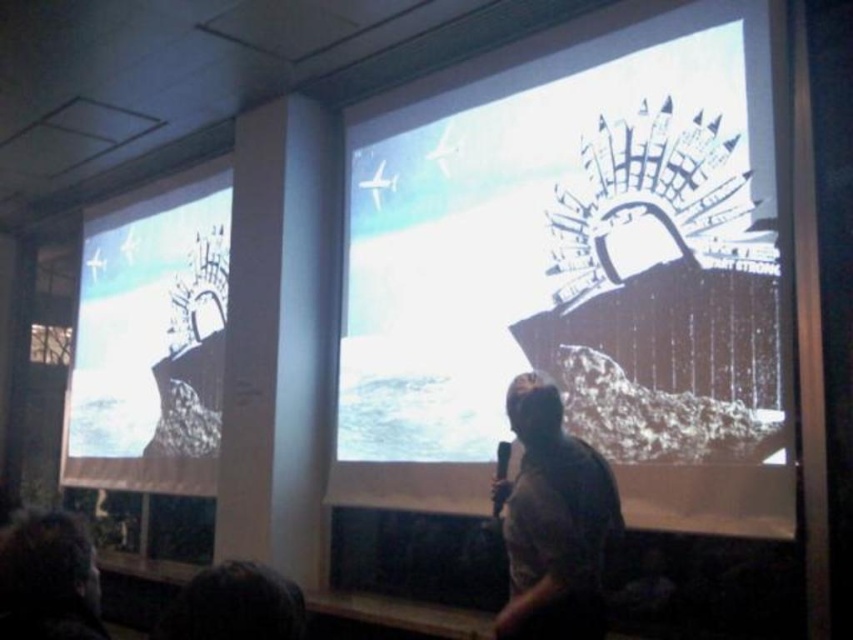
Question: Which object is positioned farthest from the gray fabric shirt at center?

Choices:
 (A) white matte ship at center
 (B) matte black ship at left

Answer: (B)

Question: Is white matte ship at center to the right of gray fabric shirt at center from the viewer's perspective?

Choices:
 (A) no
 (B) yes

Answer: (A)

Question: Which object is closer to the camera taking this photo?

Choices:
 (A) matte black ship at left
 (B) gray fabric shirt at center

Answer: (B)

Question: Can you confirm if matte black ship at left is positioned above gray fabric shirt at center?

Choices:
 (A) no
 (B) yes

Answer: (B)

Question: Which object is closer to the camera taking this photo?

Choices:
 (A) white matte ship at center
 (B) gray fabric shirt at center
 (C) matte black ship at left

Answer: (B)

Question: Can you confirm if white matte ship at center is bigger than gray fabric shirt at center?

Choices:
 (A) yes
 (B) no

Answer: (A)